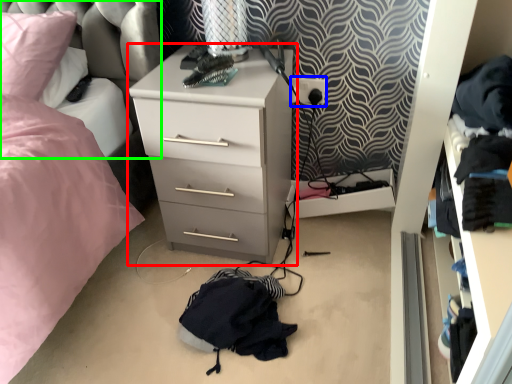
Question: Estimate the real-world distances between objects in this image. Which object is closer to chest of drawers (highlighted by a red box), electric outlet (highlighted by a blue box) or swivel chair (highlighted by a green box)?

Choices:
 (A) electric outlet
 (B) swivel chair

Answer: (B)